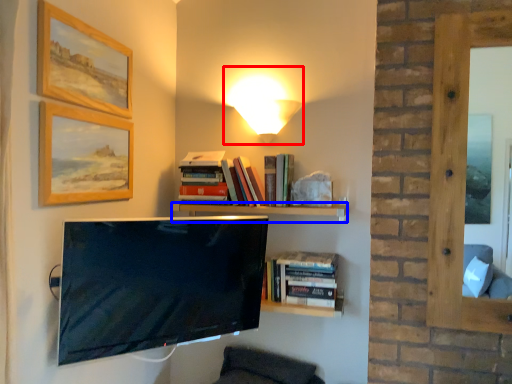
Question: Which point is closer to the camera, table lamp (highlighted by a red box) or shelf (highlighted by a blue box)?

Choices:
 (A) table lamp
 (B) shelf

Answer: (B)